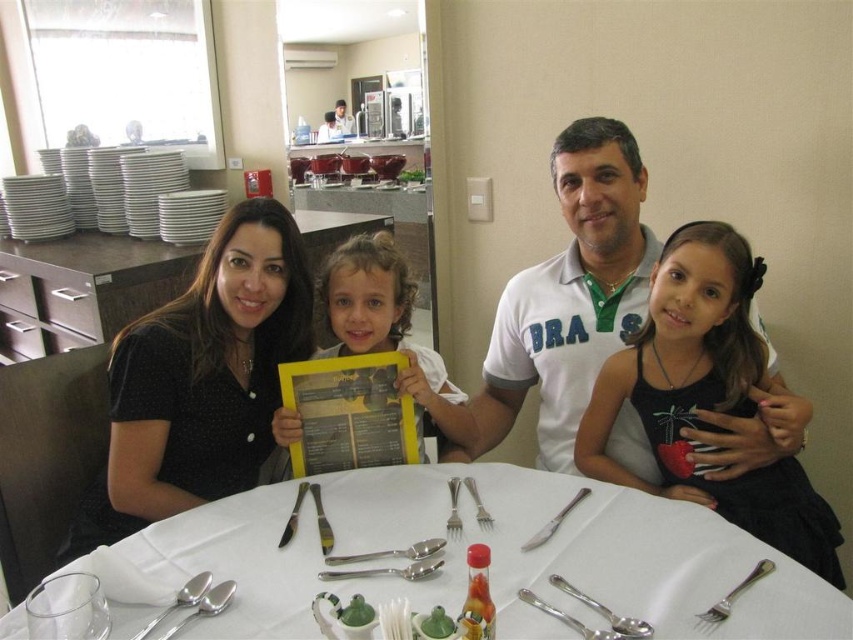
Is black satin dress at center thinner than polished metal knife at center?

Incorrect, black satin dress at center's width is not less than polished metal knife at center's.

Which is in front, point (695, 234) or point (328, 547)?

Positioned in front is point (328, 547).

Locate an element on the screen. black satin dress at center is located at coordinates (705, 396).

At what (x,y) coordinates should I click in order to perform the action: click on white polo shirt at center. Please return your answer as a coordinate pair (x, y). Image resolution: width=853 pixels, height=640 pixels. Looking at the image, I should click on (569, 298).

What do you see at coordinates (569, 298) in the screenshot?
I see `white polo shirt at center` at bounding box center [569, 298].

In order to click on white polo shirt at center in this screenshot , I will do `click(569, 298)`.

Can you confirm if yellow paper menu at center is thinner than satin silver spoon at lower left?

Incorrect, yellow paper menu at center's width is not less than satin silver spoon at lower left's.

Does yellow paper menu at center have a greater width compared to satin silver spoon at lower left?

Yes.

Find the location of a particular element. The height and width of the screenshot is (640, 853). yellow paper menu at center is located at coordinates (387, 330).

Identify the location of yellow paper menu at center. (387, 330).